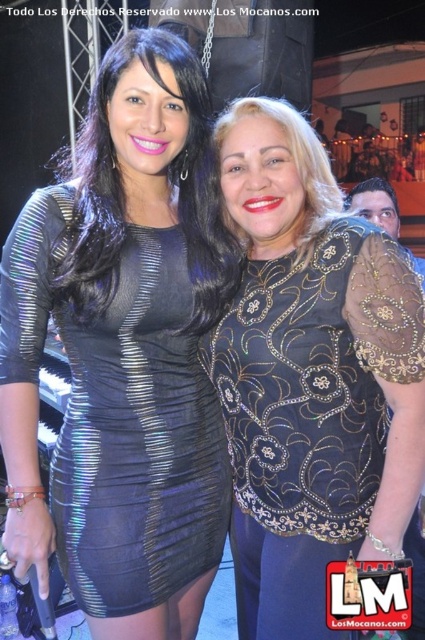
Question: Does metallic black dress at center appear on the left side of black sequined blouse at right?

Choices:
 (A) yes
 (B) no

Answer: (A)

Question: Does metallic black dress at center come behind black sequined blouse at right?

Choices:
 (A) yes
 (B) no

Answer: (B)

Question: Which object appears closest to the camera in this image?

Choices:
 (A) metallic black dress at center
 (B) black sequined blouse at right

Answer: (A)

Question: Is metallic black dress at center positioned at the back of black sequined blouse at right?

Choices:
 (A) no
 (B) yes

Answer: (A)

Question: Which of the following is the farthest from the observer?

Choices:
 (A) metallic black dress at center
 (B) black sequined blouse at right

Answer: (B)